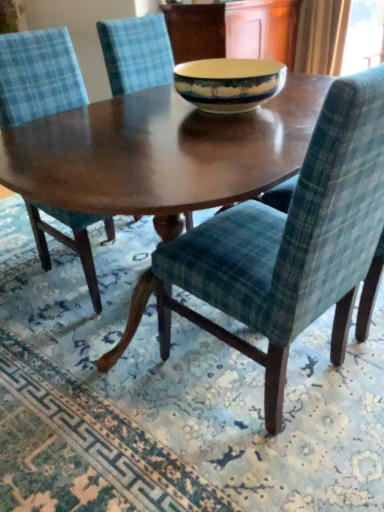
Image resolution: width=384 pixels, height=512 pixels. In order to click on green plaid fabric at lower right in this screenshot , I will do `click(169, 398)`.

What do you see at coordinates (38, 76) in the screenshot? I see `velvet blue chair at center, which ranks as the first chair in left-to-right order` at bounding box center [38, 76].

Locate an element on the screen. The width and height of the screenshot is (384, 512). velvet green chair at center, which appears as the 1th chair when viewed from the right is located at coordinates (291, 242).

Measure the distance between velvet blue chair at center, which ranks as the 2th chair in left-to-right order, and camera.

velvet blue chair at center, which ranks as the 2th chair in left-to-right order, is 1.96 meters away from camera.

The width and height of the screenshot is (384, 512). Describe the element at coordinates (136, 53) in the screenshot. I see `velvet blue chair at center, which ranks as the 2th chair in left-to-right order` at that location.

You are a GUI agent. You are given a task and a screenshot of the screen. Output one action in this format:
    pyautogui.click(x=<x>, y=<y>)
    Task: Click on the matte ceramic bowl at center
    The height and width of the screenshot is (512, 384).
    Given the screenshot: What is the action you would take?
    pyautogui.click(x=229, y=83)

Based on the photo, is velvet blue chair at center, which ranks as the first chair in left-to-right order, looking in the opposite direction of velvet green chair at center, which is the third chair from left to right?

No, velvet green chair at center, which is the third chair from left to right, is not at the back of velvet blue chair at center, which ranks as the first chair in left-to-right order.

Which is nearer, (17, 59) or (351, 111)?

Point (17, 59).

Is velvet blue chair at center, which ranks as the 3th chair in right-to-left order, bigger than velvet green chair at center, which is the third chair from left to right?

No, velvet blue chair at center, which ranks as the 3th chair in right-to-left order, is not bigger than velvet green chair at center, which is the third chair from left to right.

From a real-world perspective, which is physically above, velvet blue chair at center, which ranks as the 3th chair in right-to-left order, or velvet green chair at center, which is the third chair from left to right?

From a 3D spatial view, velvet green chair at center, which is the third chair from left to right, is above.

From their relative heights in the image, would you say velvet green chair at center, which appears as the 1th chair when viewed from the right, is taller or shorter than velvet blue chair at center, which ranks as the first chair in left-to-right order?

velvet green chair at center, which appears as the 1th chair when viewed from the right, is taller than velvet blue chair at center, which ranks as the first chair in left-to-right order.

Does velvet green chair at center, which is the third chair from left to right, touch velvet blue chair at center, which ranks as the 3th chair in right-to-left order?

No, velvet green chair at center, which is the third chair from left to right, is not beside velvet blue chair at center, which ranks as the 3th chair in right-to-left order.

Which object is wider, velvet green chair at center, which is the third chair from left to right, or velvet blue chair at center, which ranks as the 3th chair in right-to-left order?

Wider between the two is velvet green chair at center, which is the third chair from left to right.

Can you tell me how much velvet green chair at center, which is the third chair from left to right, and velvet blue chair at center, which ranks as the 3th chair in right-to-left order, differ in facing direction?

They differ by 179 degrees in their facing directions.

From the image's perspective, between velvet blue chair at center, which ranks as the 2th chair in left-to-right order, and matte ceramic bowl at center, which one is located above?

From the image's view, velvet blue chair at center, which ranks as the 2th chair in left-to-right order, is above.

In terms of size, does velvet blue chair at center, which ranks as the 2th chair in right-to-left order, appear bigger or smaller than matte ceramic bowl at center?

Considering their sizes, velvet blue chair at center, which ranks as the 2th chair in right-to-left order, takes up more space than matte ceramic bowl at center.

Considering the relative positions of velvet blue chair at center, which ranks as the 2th chair in right-to-left order, and matte ceramic bowl at center in the image provided, is velvet blue chair at center, which ranks as the 2th chair in right-to-left order, in front of matte ceramic bowl at center?

No, it is behind matte ceramic bowl at center.

What's the angular difference between velvet blue chair at center, which ranks as the 2th chair in left-to-right order, and matte ceramic bowl at center's facing directions?

The facing directions of velvet blue chair at center, which ranks as the 2th chair in left-to-right order, and matte ceramic bowl at center are 4.21 degrees apart.

From the image's perspective, is velvet blue chair at center, which ranks as the 2th chair in left-to-right order, beneath velvet green chair at center, which is the third chair from left to right?

Incorrect, from the image's perspective, velvet blue chair at center, which ranks as the 2th chair in left-to-right order, is higher than velvet green chair at center, which is the third chair from left to right.

Which is correct: velvet blue chair at center, which ranks as the 2th chair in right-to-left order, is inside velvet green chair at center, which is the third chair from left to right, or outside of it?

velvet blue chair at center, which ranks as the 2th chair in right-to-left order, lies outside velvet green chair at center, which is the third chair from left to right.

Between velvet blue chair at center, which ranks as the 2th chair in right-to-left order, and velvet green chair at center, which appears as the 1th chair when viewed from the right, which one appears on the right side from the viewer's perspective?

From the viewer's perspective, velvet green chair at center, which appears as the 1th chair when viewed from the right, appears more on the right side.

From the velvet green chair at center, which is the third chair from left to right, count 2nd chairs backward and point to it. Please provide its 2D coordinates.

[(136, 53)]

Considering the sizes of objects green plaid fabric at lower right and velvet blue chair at center, which ranks as the 2th chair in left-to-right order, in the image provided, who is taller, green plaid fabric at lower right or velvet blue chair at center, which ranks as the 2th chair in left-to-right order,?

Standing taller between the two is velvet blue chair at center, which ranks as the 2th chair in left-to-right order.

Can you confirm if green plaid fabric at lower right is positioned to the left of velvet blue chair at center, which ranks as the 2th chair in left-to-right order?

Yes, green plaid fabric at lower right is to the left of velvet blue chair at center, which ranks as the 2th chair in left-to-right order.

Is green plaid fabric at lower right positioned with its back to velvet blue chair at center, which ranks as the 2th chair in right-to-left order?

green plaid fabric at lower right does not have its back to velvet blue chair at center, which ranks as the 2th chair in right-to-left order.

Which is more distant, (258, 80) or (68, 225)?

The point (68, 225) is behind.

The image size is (384, 512). I want to click on the 2nd chair to the left of the matte ceramic bowl at center, starting your count from the anchor, so click(38, 76).

Is matte ceramic bowl at center looking in the opposite direction of velvet blue chair at center, which ranks as the 3th chair in right-to-left order?

That's not correct — matte ceramic bowl at center is not looking away from velvet blue chair at center, which ranks as the 3th chair in right-to-left order.

Considering the relative sizes of matte ceramic bowl at center and velvet blue chair at center, which ranks as the 3th chair in right-to-left order, in the image provided, is matte ceramic bowl at center bigger than velvet blue chair at center, which ranks as the 3th chair in right-to-left order,?

No.

Does green plaid fabric at lower right appear on the right side of velvet blue chair at center, which ranks as the first chair in left-to-right order?

Indeed, green plaid fabric at lower right is positioned on the right side of velvet blue chair at center, which ranks as the first chair in left-to-right order.

Is point (201, 456) closer or farther from the camera than point (34, 117)?

Clearly, point (201, 456) is closer to the camera than point (34, 117).

From the image's perspective, which is above, green plaid fabric at lower right or velvet blue chair at center, which ranks as the first chair in left-to-right order?

velvet blue chair at center, which ranks as the first chair in left-to-right order.

Locate an element on the screen. The width and height of the screenshot is (384, 512). chair below the velvet blue chair at center, which ranks as the first chair in left-to-right order (from the image's perspective) is located at coordinates (291, 242).

This screenshot has width=384, height=512. I want to click on the 2nd chair counting from the left of the velvet green chair at center, which appears as the 1th chair when viewed from the right, so click(x=38, y=76).

Which object lies further to the anchor point matte ceramic bowl at center, green plaid fabric at lower right or velvet green chair at center, which is the third chair from left to right?

Among the two, green plaid fabric at lower right is located further to matte ceramic bowl at center.

When comparing their distances from green plaid fabric at lower right, does velvet green chair at center, which appears as the 1th chair when viewed from the right, or matte ceramic bowl at center seem closer?

velvet green chair at center, which appears as the 1th chair when viewed from the right, lies closer to green plaid fabric at lower right than the other object.

Based on their spatial positions, is matte ceramic bowl at center or velvet blue chair at center, which ranks as the 3th chair in right-to-left order, further from green plaid fabric at lower right?

Based on the image, matte ceramic bowl at center appears to be further to green plaid fabric at lower right.

Which object lies further to the anchor point velvet blue chair at center, which ranks as the 3th chair in right-to-left order, velvet green chair at center, which is the third chair from left to right, or velvet blue chair at center, which ranks as the 2th chair in right-to-left order?

Among the two, velvet blue chair at center, which ranks as the 2th chair in right-to-left order, is located further to velvet blue chair at center, which ranks as the 3th chair in right-to-left order.

Based on their spatial positions, is velvet green chair at center, which is the third chair from left to right, or velvet blue chair at center, which ranks as the 3th chair in right-to-left order, closer to green plaid fabric at lower right?

velvet green chair at center, which is the third chair from left to right, lies closer to green plaid fabric at lower right than the other object.

Estimate the real-world distances between objects in this image. Which object is further from matte ceramic bowl at center, velvet green chair at center, which appears as the 1th chair when viewed from the right, or green plaid fabric at lower right?

Among the two, green plaid fabric at lower right is located further to matte ceramic bowl at center.

Looking at the image, which one is located closer to velvet green chair at center, which is the third chair from left to right, velvet blue chair at center, which ranks as the 2th chair in left-to-right order, or velvet blue chair at center, which ranks as the 3th chair in right-to-left order?

velvet blue chair at center, which ranks as the 3th chair in right-to-left order, is closer to velvet green chair at center, which is the third chair from left to right.

Considering their positions, is velvet blue chair at center, which ranks as the 2th chair in right-to-left order, positioned further to green plaid fabric at lower right than velvet blue chair at center, which ranks as the first chair in left-to-right order?

velvet blue chair at center, which ranks as the 2th chair in right-to-left order.

Image resolution: width=384 pixels, height=512 pixels. Find the location of `chair located between velvet blue chair at center, which ranks as the first chair in left-to-right order, and matte ceramic bowl at center in the left-right direction`. chair located between velvet blue chair at center, which ranks as the first chair in left-to-right order, and matte ceramic bowl at center in the left-right direction is located at coordinates (136, 53).

Find the location of a particular element. bowl between velvet blue chair at center, which ranks as the first chair in left-to-right order, and velvet green chair at center, which is the third chair from left to right, in the horizontal direction is located at coordinates (229, 83).

Identify the location of place mat between velvet green chair at center, which appears as the 1th chair when viewed from the right, and velvet blue chair at center, which ranks as the 2th chair in left-to-right order, from front to back. The height and width of the screenshot is (512, 384). (169, 398).

Where is `place mat located between velvet blue chair at center, which ranks as the 3th chair in right-to-left order, and velvet green chair at center, which appears as the 1th chair when viewed from the right, in the left-right direction`? The image size is (384, 512). place mat located between velvet blue chair at center, which ranks as the 3th chair in right-to-left order, and velvet green chair at center, which appears as the 1th chair when viewed from the right, in the left-right direction is located at coordinates (169, 398).